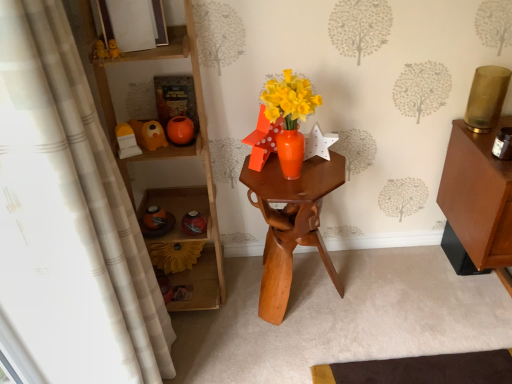
Question: Can you confirm if matte yellow plastic toy at left, which is the 2th toy in back-to-front order, is positioned to the right of matte white picture frame at upper center?

Choices:
 (A) yes
 (B) no

Answer: (B)

Question: Could you tell me if matte yellow plastic toy at left, positioned as the 1th toy in front-to-back order, is facing matte white picture frame at upper center?

Choices:
 (A) no
 (B) yes

Answer: (A)

Question: Considering the relative sizes of matte yellow plastic toy at left, positioned as the 1th toy in front-to-back order, and matte white picture frame at upper center in the image provided, is matte yellow plastic toy at left, positioned as the 1th toy in front-to-back order, thinner than matte white picture frame at upper center?

Choices:
 (A) yes
 (B) no

Answer: (B)

Question: Is matte yellow plastic toy at left, positioned as the 1th toy in front-to-back order, closer to camera compared to matte white picture frame at upper center?

Choices:
 (A) no
 (B) yes

Answer: (A)

Question: Is matte yellow plastic toy at left, positioned as the 1th toy in front-to-back order, facing away from matte white picture frame at upper center?

Choices:
 (A) no
 (B) yes

Answer: (A)

Question: Considering the positions of point tap(304, 182) and point tap(186, 301), is point tap(304, 182) closer or farther from the camera than point tap(186, 301)?

Choices:
 (A) farther
 (B) closer

Answer: (B)

Question: Considering the positions of wooden hexagonal table at center and wooden shelf at left in the image, is wooden hexagonal table at center bigger or smaller than wooden shelf at left?

Choices:
 (A) small
 (B) big

Answer: (A)

Question: Considering the positions of wooden hexagonal table at center and wooden shelf at left in the image, is wooden hexagonal table at center taller or shorter than wooden shelf at left?

Choices:
 (A) short
 (B) tall

Answer: (A)

Question: Considering their positions, is wooden hexagonal table at center located in front of or behind wooden shelf at left?

Choices:
 (A) behind
 (B) front

Answer: (A)

Question: Considering the positions of matte orange vase at center, the second toy from the front, and matte yellow plastic toy at left, positioned as the 1th toy in front-to-back order, in the image, is matte orange vase at center, the second toy from the front, taller or shorter than matte yellow plastic toy at left, positioned as the 1th toy in front-to-back order,?

Choices:
 (A) short
 (B) tall

Answer: (A)

Question: Considering their positions, is matte orange vase at center, the second toy from the front, located in front of or behind matte yellow plastic toy at left, which is the 2th toy in back-to-front order?

Choices:
 (A) behind
 (B) front

Answer: (A)

Question: Considering the positions of point (142, 122) and point (117, 139), is point (142, 122) closer or farther from the camera than point (117, 139)?

Choices:
 (A) farther
 (B) closer

Answer: (A)

Question: From the image's perspective, is matte orange vase at center, arranged as the first toy when viewed from the back, positioned above or below matte yellow plastic toy at left, which is the 2th toy in back-to-front order?

Choices:
 (A) below
 (B) above

Answer: (B)

Question: From a real-world perspective, relative to white textured curtain at left, is matte orange vase at center, arranged as the first toy when viewed from the back, vertically above or below?

Choices:
 (A) above
 (B) below

Answer: (A)

Question: Do you think matte orange vase at center, the second toy from the front, is within white textured curtain at left, or outside of it?

Choices:
 (A) inside
 (B) outside

Answer: (B)